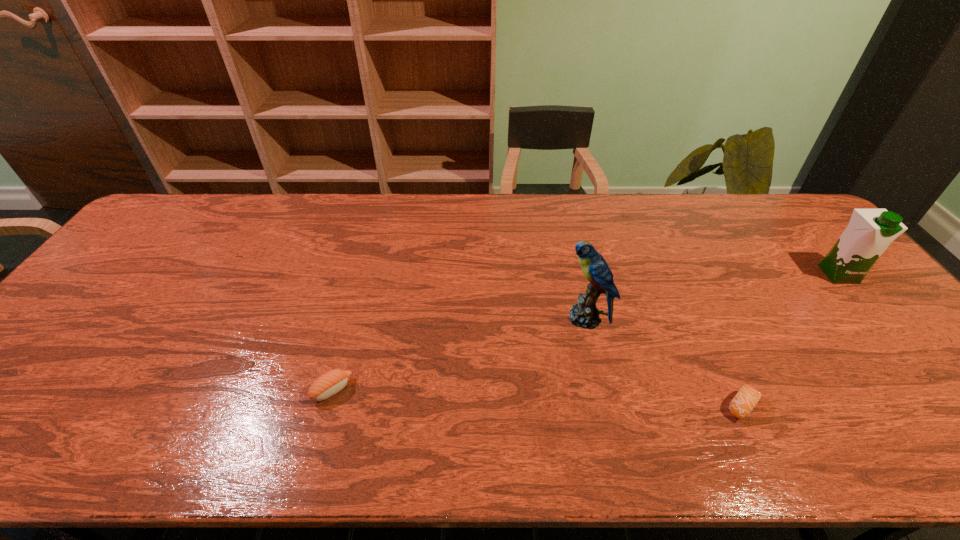
Where is `vacant space that's between the rightmost object and the third nearest object`? The height and width of the screenshot is (540, 960). vacant space that's between the rightmost object and the third nearest object is located at coordinates (712, 296).

I want to click on vacant region between the shortest object and the left sushi, so click(x=538, y=398).

Where is `free area in between the left sushi and the shortest object`? free area in between the left sushi and the shortest object is located at coordinates pos(538,398).

You are a GUI agent. You are given a task and a screenshot of the screen. Output one action in this format:
    pyautogui.click(x=<x>, y=<y>)
    Task: Click on the empty location between the shortest object and the second object from left to right
    
    Given the screenshot: What is the action you would take?
    coord(664,362)

Where is `free space that is in between the farthest object and the taller sushi`? The width and height of the screenshot is (960, 540). free space that is in between the farthest object and the taller sushi is located at coordinates (586, 332).

At what (x,y) coordinates should I click in order to perform the action: click on unoccupied position between the shortest object and the third nearest object. Please return your answer as a coordinate pair (x, y). This screenshot has height=540, width=960. Looking at the image, I should click on (664, 362).

Identify the location of vacant region between the farthest object and the leftmost object. (586, 332).

Find the location of a particular element. vacant area between the second farthest object and the right sushi is located at coordinates (664, 362).

This screenshot has width=960, height=540. What are the coordinates of `unoccupied position between the parrot and the third tallest object` in the screenshot? It's located at (459, 354).

Select which object appears as the third closest to the farthest object. Please provide its 2D coordinates. Your answer should be formatted as a tuple, i.e. [(x, y)], where the tuple contains the x and y coordinates of a point satisfying the conditions above.

[(331, 382)]